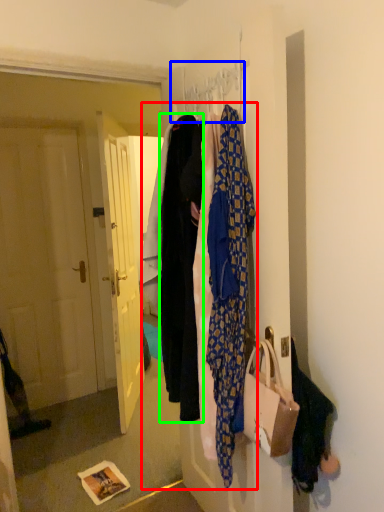
Question: Estimate the real-world distances between objects in this image. Which object is closer to closet (highlighted by a red box), hanger (highlighted by a blue box) or garment (highlighted by a green box)?

Choices:
 (A) hanger
 (B) garment

Answer: (B)